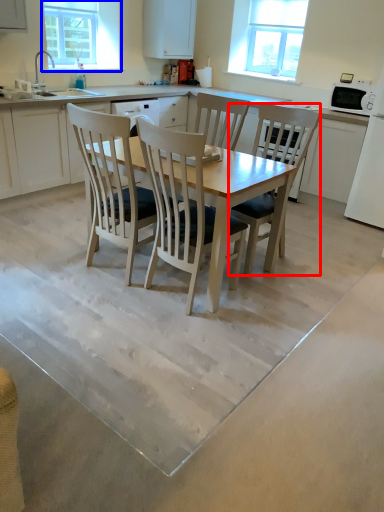
Question: Which object is closer to the camera taking this photo, chair (highlighted by a red box) or window screen (highlighted by a blue box)?

Choices:
 (A) chair
 (B) window screen

Answer: (A)